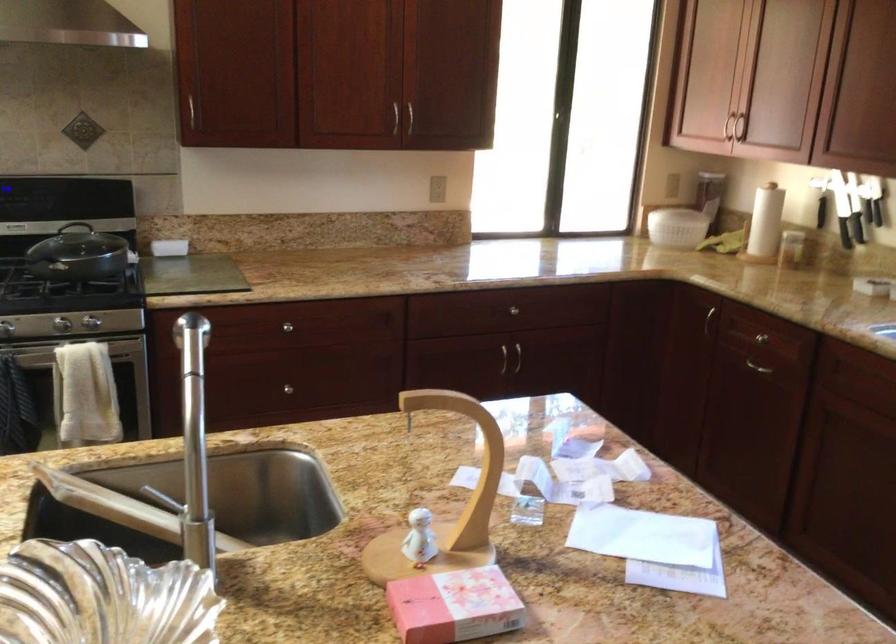
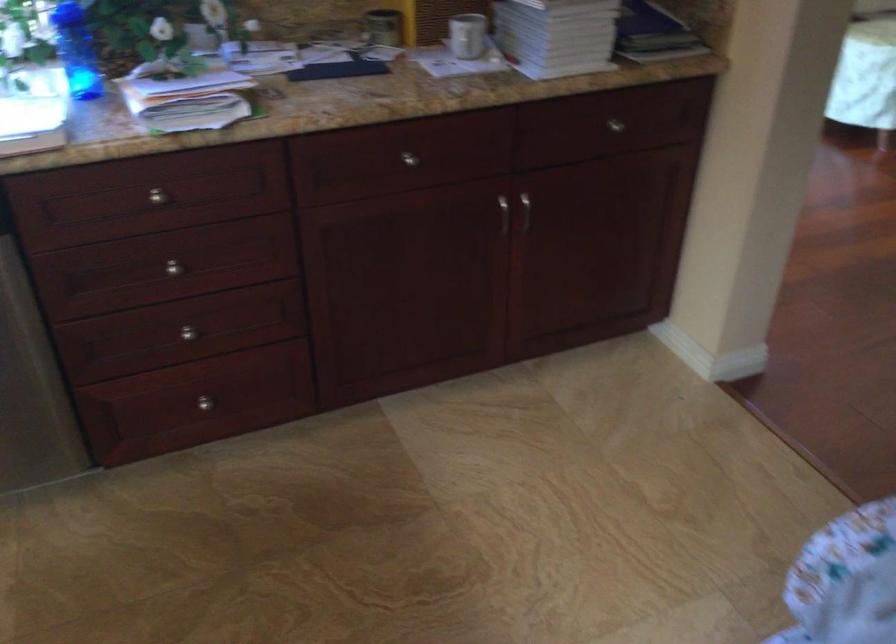
Consider the image. First-person continuous shooting, in which direction is the camera rotating?

The rotation direction of the camera is right-down.